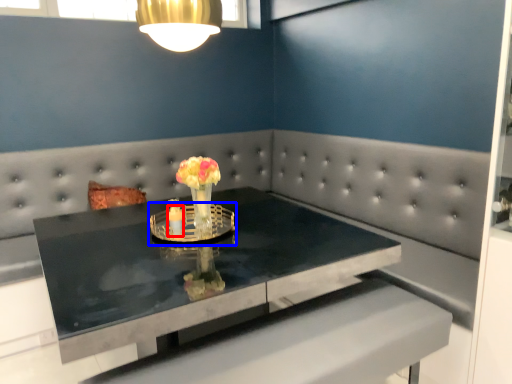
Question: Which of the following is the closest to the observer, candle holder (highlighted by a red box) or candle holder (highlighted by a blue box)?

Choices:
 (A) candle holder
 (B) candle holder

Answer: (B)